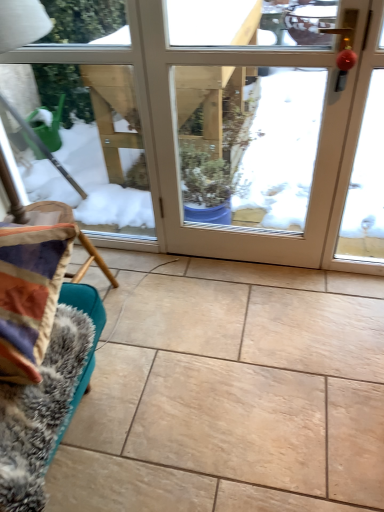
Question: Is beige ceramic tile at center oriented away from fuzzy fabric couch at lower left?

Choices:
 (A) no
 (B) yes

Answer: (A)

Question: Does beige ceramic tile at center have a smaller size compared to fuzzy fabric couch at lower left?

Choices:
 (A) no
 (B) yes

Answer: (A)

Question: From a real-world perspective, is beige ceramic tile at center physically below fuzzy fabric couch at lower left?

Choices:
 (A) yes
 (B) no

Answer: (A)

Question: Is beige ceramic tile at center shorter than fuzzy fabric couch at lower left?

Choices:
 (A) no
 (B) yes

Answer: (B)

Question: Is fuzzy fabric couch at lower left inside beige ceramic tile at center?

Choices:
 (A) yes
 (B) no

Answer: (B)

Question: Does point (256, 339) appear closer or farther from the camera than point (8, 459)?

Choices:
 (A) farther
 (B) closer

Answer: (A)

Question: Considering their positions, is beige ceramic tile at center located in front of or behind fuzzy fabric couch at lower left?

Choices:
 (A) front
 (B) behind

Answer: (B)

Question: Is beige ceramic tile at center wider or thinner than fuzzy fabric couch at lower left?

Choices:
 (A) wide
 (B) thin

Answer: (A)

Question: From a real-world perspective, is beige ceramic tile at center above or below fuzzy fabric couch at lower left?

Choices:
 (A) below
 (B) above

Answer: (A)

Question: Is white glossy door at center inside or outside of fuzzy fabric couch at lower left?

Choices:
 (A) inside
 (B) outside

Answer: (B)

Question: In terms of width, does white glossy door at center look wider or thinner when compared to fuzzy fabric couch at lower left?

Choices:
 (A) thin
 (B) wide

Answer: (A)

Question: In the image, is white glossy door at center positioned in front of or behind fuzzy fabric couch at lower left?

Choices:
 (A) behind
 (B) front

Answer: (A)

Question: From their relative heights in the image, would you say white glossy door at center is taller or shorter than fuzzy fabric couch at lower left?

Choices:
 (A) short
 (B) tall

Answer: (B)

Question: From a real-world perspective, relative to white glossy door at center, is beige ceramic tile at center vertically above or below?

Choices:
 (A) above
 (B) below

Answer: (B)

Question: Is beige ceramic tile at center spatially inside white glossy door at center, or outside of it?

Choices:
 (A) inside
 (B) outside

Answer: (B)